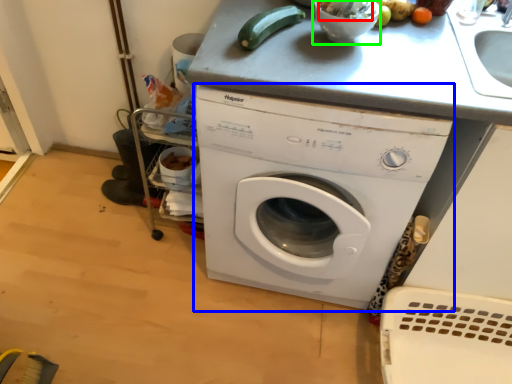
Question: Which object is the closest to the food (highlighted by a red box)? Choose among these: washing machine (highlighted by a blue box) or mixing bowl (highlighted by a green box).

Choices:
 (A) washing machine
 (B) mixing bowl

Answer: (B)